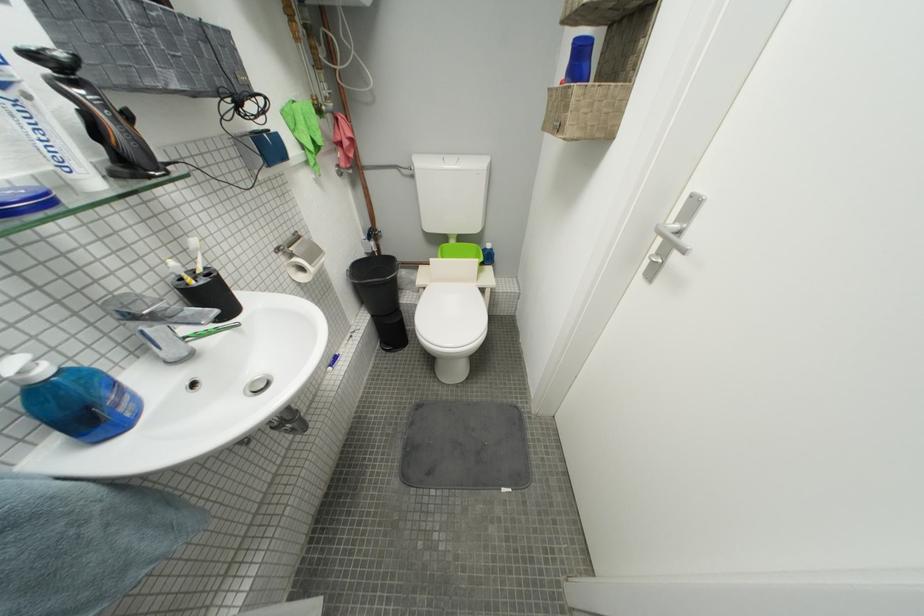
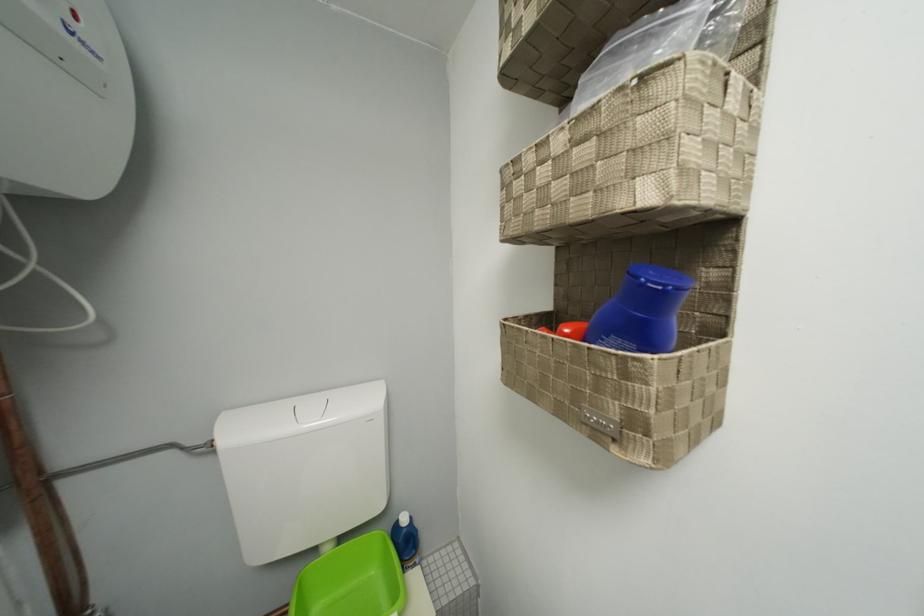
Find the pixel in the second image that matches the point at 460,244 in the first image.

(335, 552)